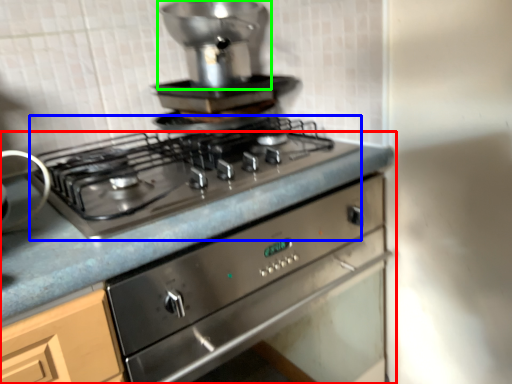
Question: Which is farther away from countertop (highlighted by a red box)? gas stove (highlighted by a blue box) or appliance (highlighted by a green box)?

Choices:
 (A) gas stove
 (B) appliance

Answer: (B)